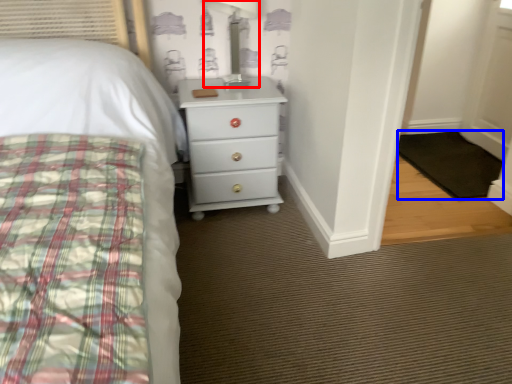
Question: Which object is further to the camera taking this photo, table lamp (highlighted by a red box) or mat (highlighted by a blue box)?

Choices:
 (A) table lamp
 (B) mat

Answer: (B)